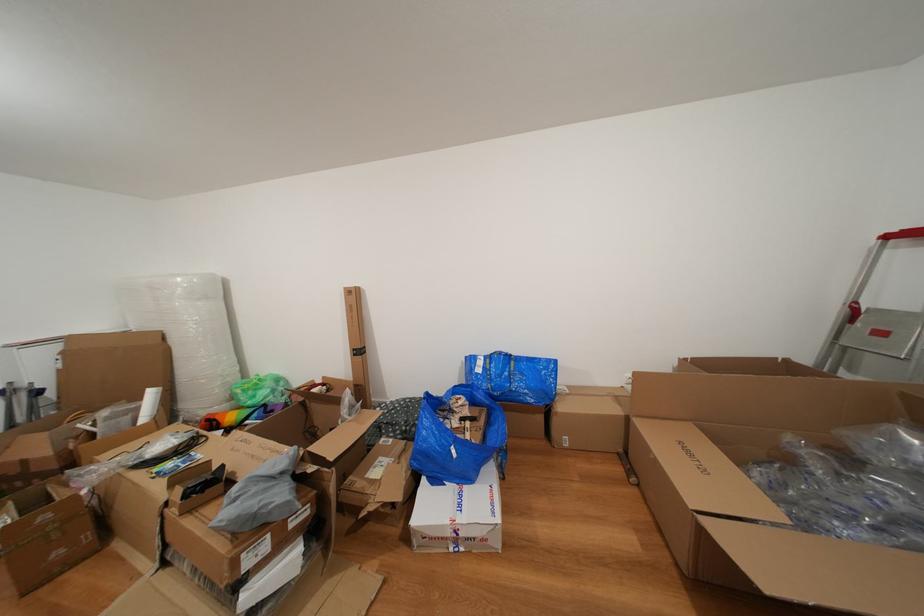
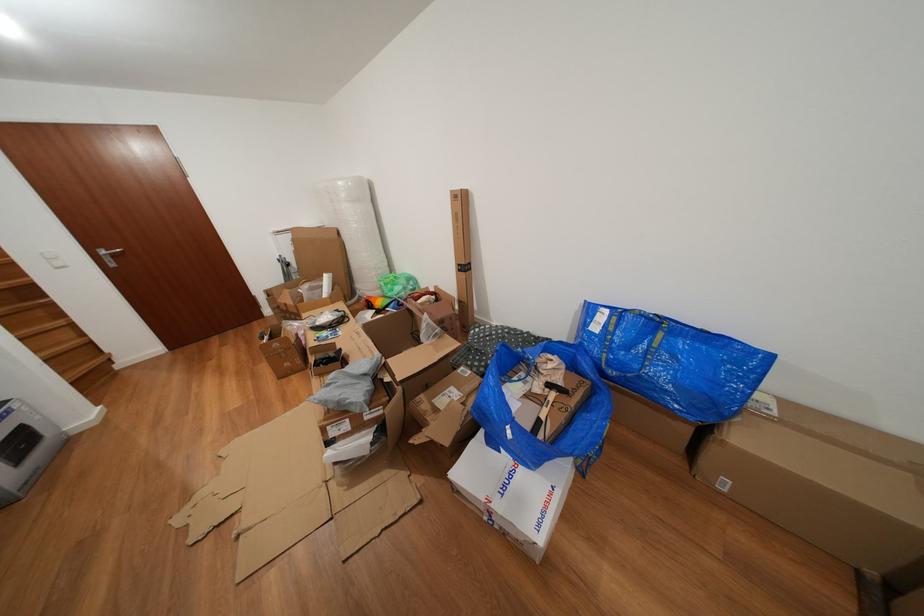
The point at (x=362, y=360) is marked in the first image. Where is the corresponding point in the second image?

(468, 276)